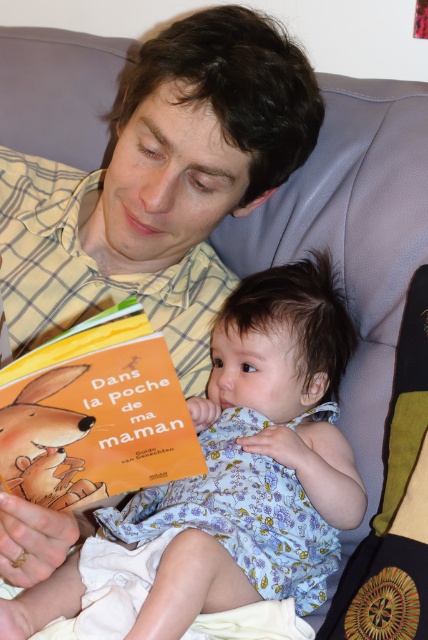
Who is lower down, light blue fabric dress at center or orange matte book at center?

light blue fabric dress at center is below.

Is light blue fabric dress at center below orange matte book at center?

Indeed, light blue fabric dress at center is positioned under orange matte book at center.

At what (x,y) coordinates should I click in order to perform the action: click on light blue fabric dress at center. Please return your answer as a coordinate pair (x, y). Looking at the image, I should click on [x=255, y=460].